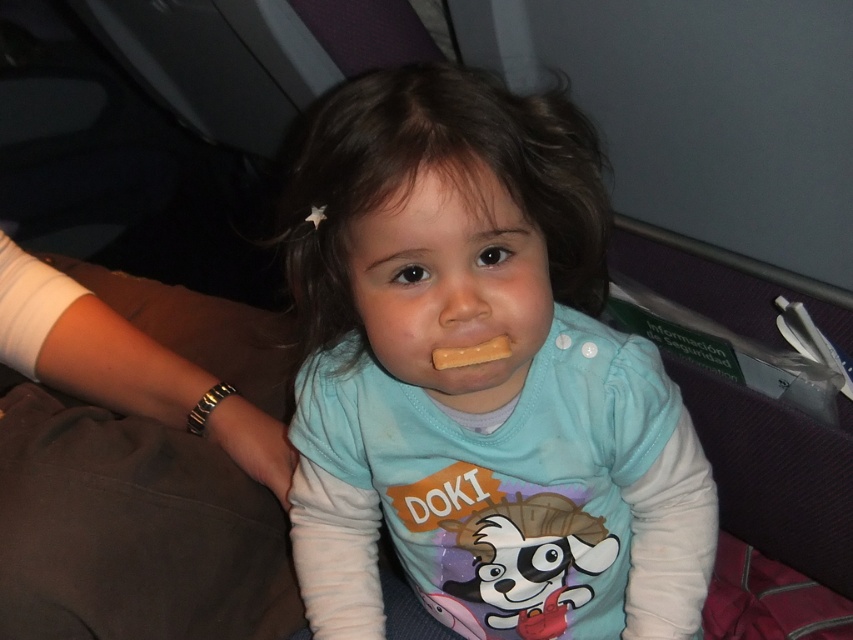
The child is wearing a matte blue shirt at center and has a yellow matte stick at mouth. Which object is nearer to you when looking at the scene?

The matte blue shirt at center is closer to the viewer than the yellow matte stick at mouth.

You are a flight attendant on an airplane and need to place a small toy for a child. The toy must be placed between the two points labeled as point (523, 268) and point (508, 346). Given that the toy requires 0.1 units of space in both x and y directions, will there be enough space between these two points to place the toy?

Point (523, 268) is behind point (508, 346), so the distance between them is sufficient to accommodate the toy requiring 0.1 units of space in both x and y directions.